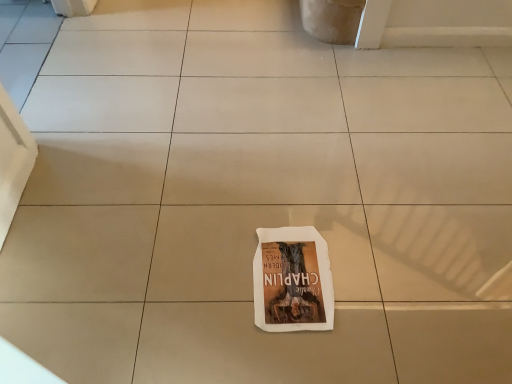
Where is `vacant area on the back side of white paper magazine at center`? Image resolution: width=512 pixels, height=384 pixels. vacant area on the back side of white paper magazine at center is located at coordinates (287, 197).